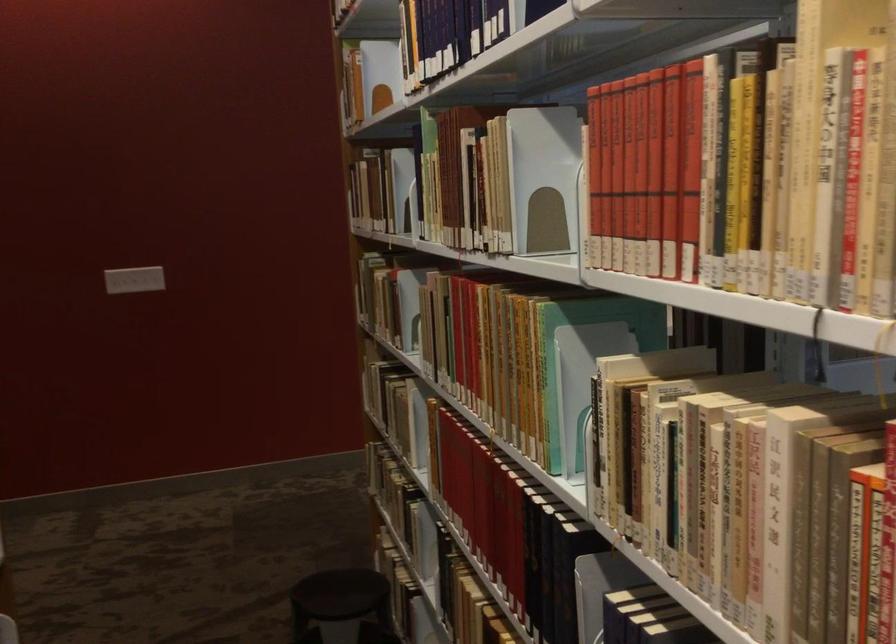
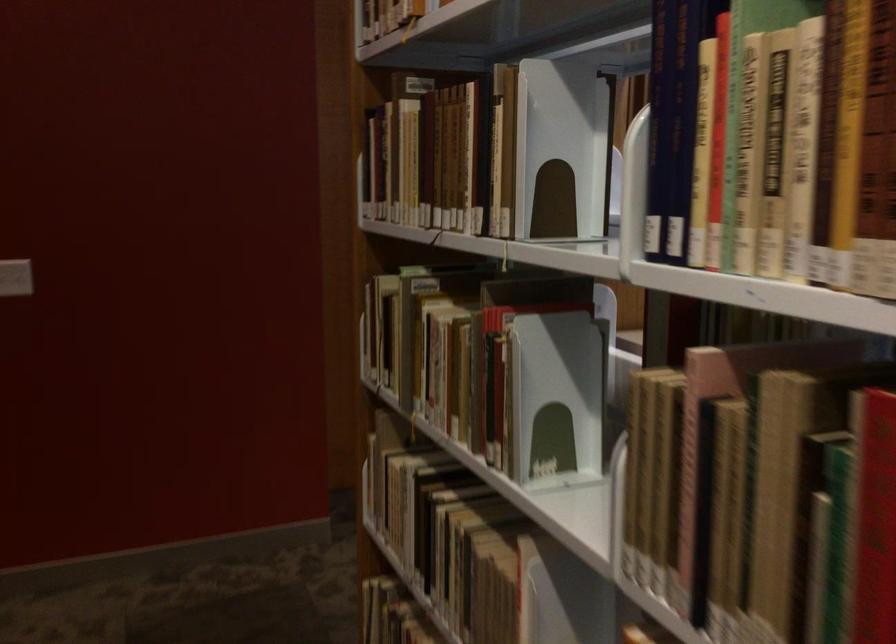
The point at (365, 187) is marked in the first image. Where is the corresponding point in the second image?

(425, 158)